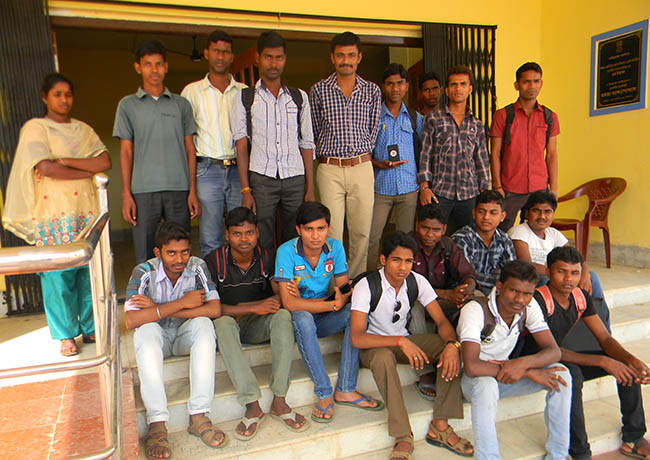
This screenshot has width=650, height=460. Identify the location of chair. (613, 216).